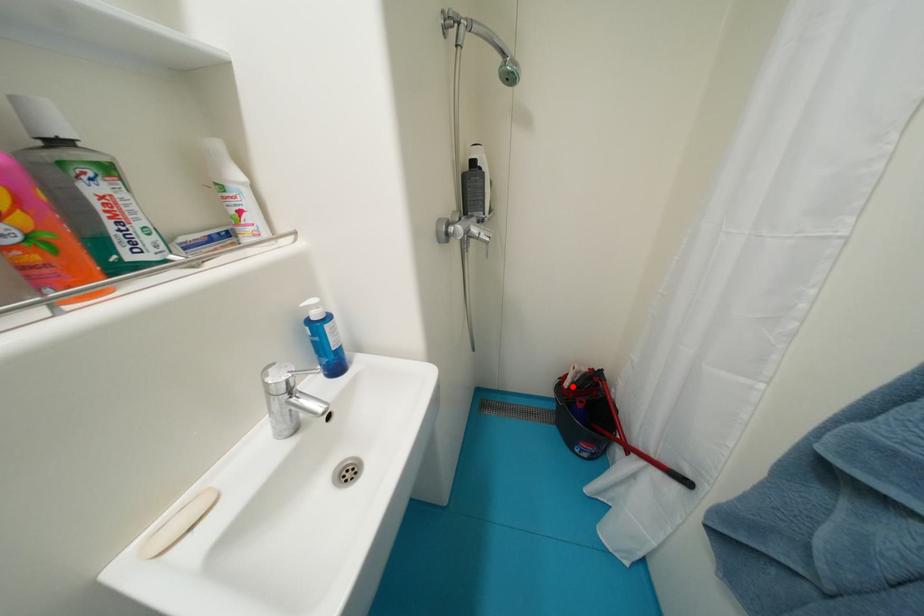
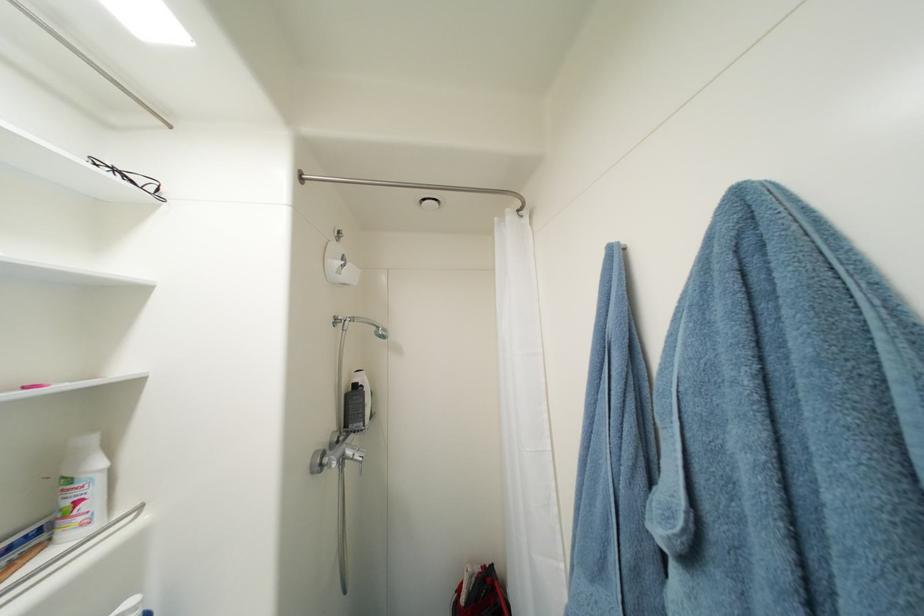
Question: A red point is marked in image1. In image2, is the corresponding 3D point closer to the camera or farther? Reply with the corresponding letter.

Choices:
 (A) The corresponding 3D point is closer.
 (B) The corresponding 3D point is farther.

Answer: (B)